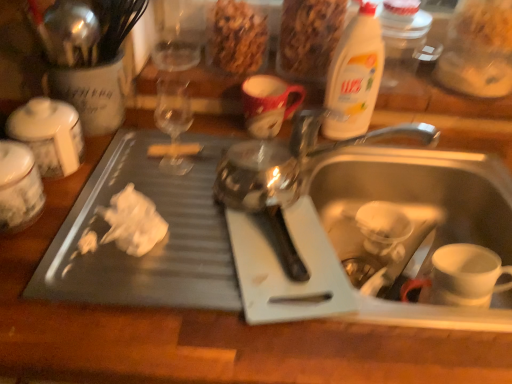
Question: Is white plastic bottle at upper right smaller than white matte coffee cup at sink bottom?

Choices:
 (A) yes
 (B) no

Answer: (B)

Question: Considering the relative sizes of white plastic bottle at upper right and white matte coffee cup at sink bottom in the image provided, is white plastic bottle at upper right thinner than white matte coffee cup at sink bottom?

Choices:
 (A) no
 (B) yes

Answer: (B)

Question: Considering the relative sizes of white plastic bottle at upper right and white matte coffee cup at sink bottom in the image provided, is white plastic bottle at upper right bigger than white matte coffee cup at sink bottom?

Choices:
 (A) yes
 (B) no

Answer: (A)

Question: Is white plastic bottle at upper right outside white matte coffee cup at sink bottom?

Choices:
 (A) no
 (B) yes

Answer: (B)

Question: Is white plastic bottle at upper right shorter than white matte coffee cup at sink bottom?

Choices:
 (A) yes
 (B) no

Answer: (B)

Question: Relative to white plastic bottle at upper right, is white matte coffee cup at sink bottom in front or behind?

Choices:
 (A) front
 (B) behind

Answer: (A)

Question: From the image's perspective, is white matte coffee cup at sink bottom positioned above or below white plastic bottle at upper right?

Choices:
 (A) above
 (B) below

Answer: (B)

Question: Is white matte coffee cup at sink bottom wider or thinner than white plastic bottle at upper right?

Choices:
 (A) thin
 (B) wide

Answer: (B)

Question: Visually, is white matte coffee cup at sink bottom positioned to the left or to the right of white plastic bottle at upper right?

Choices:
 (A) left
 (B) right

Answer: (B)

Question: Looking at the image, does crumbly brown granola at upper center, arranged as the second food when viewed from the right, seem bigger or smaller compared to granular brown cereal at upper center, marked as the 2th food in a left-to-right arrangement?

Choices:
 (A) small
 (B) big

Answer: (A)

Question: Considering the positions of point (254, 14) and point (331, 8), is point (254, 14) closer or farther from the camera than point (331, 8)?

Choices:
 (A) closer
 (B) farther

Answer: (B)

Question: From a real-world perspective, relative to granular brown cereal at upper center, positioned as the first food in right-to-left order, is crumbly brown granola at upper center, arranged as the second food when viewed from the right, vertically above or below?

Choices:
 (A) above
 (B) below

Answer: (B)

Question: Which is correct: crumbly brown granola at upper center, arranged as the second food when viewed from the right, is inside granular brown cereal at upper center, positioned as the first food in right-to-left order, or outside of it?

Choices:
 (A) inside
 (B) outside

Answer: (B)

Question: Is white plastic sink at lower right to the left or to the right of matte ceramic mug at upper center in the image?

Choices:
 (A) right
 (B) left

Answer: (A)

Question: In the image, is white plastic sink at lower right positioned in front of or behind matte ceramic mug at upper center?

Choices:
 (A) behind
 (B) front

Answer: (B)